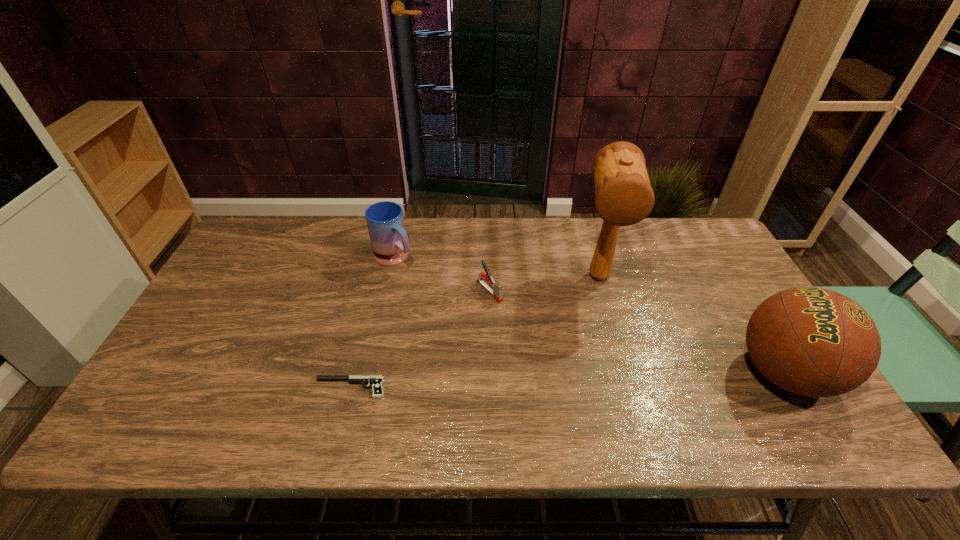
Where is `vacant space located 0.070m on the handle side of the fourth tallest object`? vacant space located 0.070m on the handle side of the fourth tallest object is located at coordinates (513, 316).

Where is `mallet that is at the far edge`? The height and width of the screenshot is (540, 960). mallet that is at the far edge is located at coordinates (624, 196).

At what (x,y) coordinates should I click in order to perform the action: click on mug present at the far edge. Please return your answer as a coordinate pair (x, y). The width and height of the screenshot is (960, 540). Looking at the image, I should click on (385, 221).

At what (x,y) coordinates should I click in order to perform the action: click on pistol that is positioned at the near edge. Please return your answer as a coordinate pair (x, y). This screenshot has height=540, width=960. Looking at the image, I should click on (376, 380).

Where is `basketball located in the near edge section of the desktop`? basketball located in the near edge section of the desktop is located at coordinates (815, 342).

Where is `object that is at the right edge`? This screenshot has width=960, height=540. object that is at the right edge is located at coordinates (815, 342).

The image size is (960, 540). I want to click on object at the near right corner, so click(815, 342).

Where is `vacant region at the far edge of the desktop`? The height and width of the screenshot is (540, 960). vacant region at the far edge of the desktop is located at coordinates (301, 243).

The image size is (960, 540). I want to click on vacant space at the near edge of the desktop, so click(325, 387).

This screenshot has width=960, height=540. I want to click on vacant space at the left edge of the desktop, so click(206, 308).